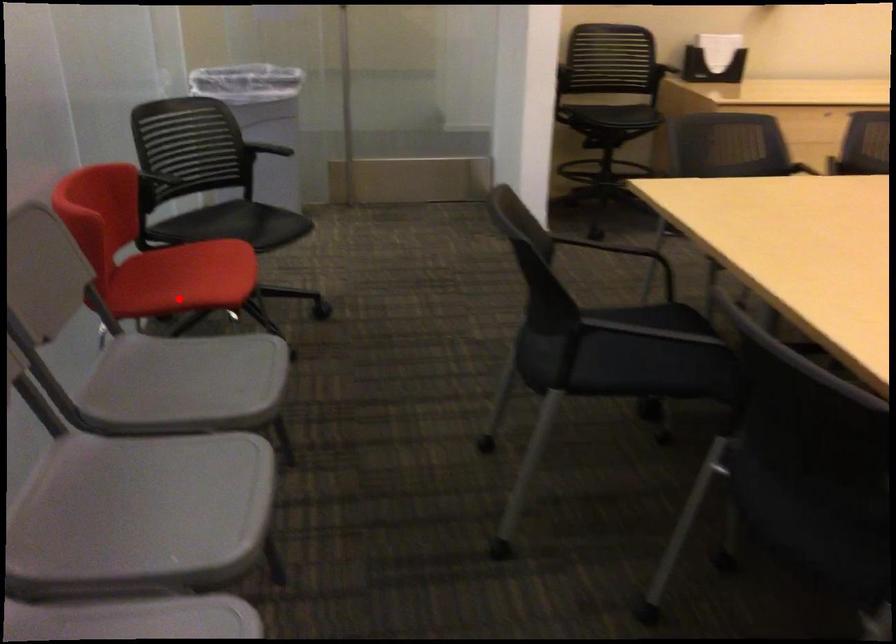
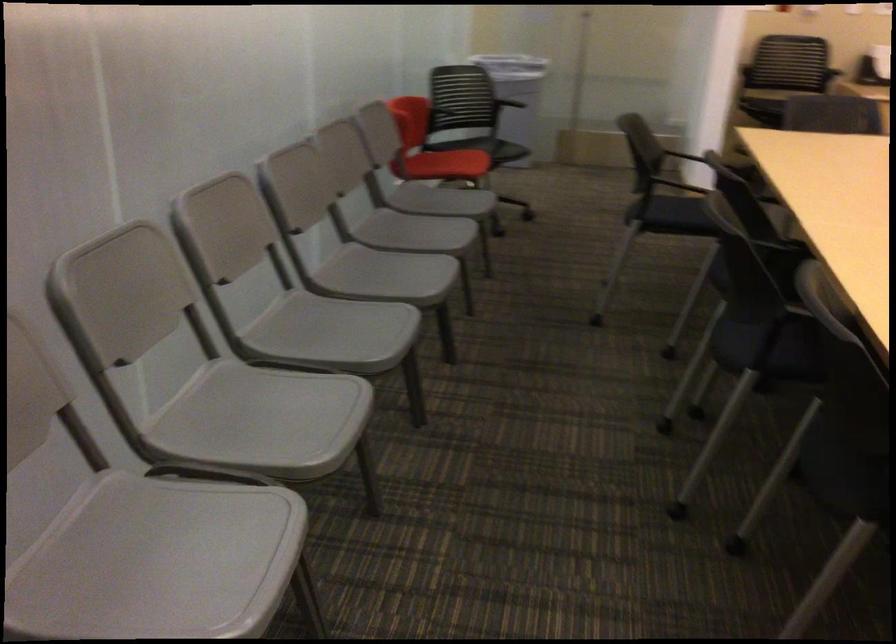
Question: I am providing you with two images of the same scene from different viewpoints. A red point is shown in image1. For the corresponding object point in image2, is it positioned nearer or farther from the camera?

Choices:
 (A) Nearer
 (B) Farther

Answer: (B)